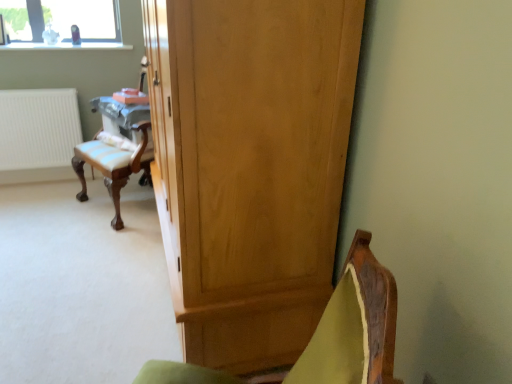
Question: Does light brown wood cupboard at center have a smaller size compared to white matte radiator at left?

Choices:
 (A) no
 (B) yes

Answer: (A)

Question: Is white matte radiator at left located within light brown wood cupboard at center?

Choices:
 (A) no
 (B) yes

Answer: (A)

Question: Can you confirm if light brown wood cupboard at center is positioned to the left of white matte radiator at left?

Choices:
 (A) yes
 (B) no

Answer: (B)

Question: Is light brown wood cupboard at center positioned in front of white matte radiator at left?

Choices:
 (A) yes
 (B) no

Answer: (A)

Question: Is light brown wood cupboard at center positioned beyond the bounds of white matte radiator at left?

Choices:
 (A) no
 (B) yes

Answer: (B)

Question: From a real-world perspective, is light brown wood cupboard at center below white matte radiator at left?

Choices:
 (A) yes
 (B) no

Answer: (B)

Question: Are white matte radiator at left and velvet green chair at lower right far apart?

Choices:
 (A) yes
 (B) no

Answer: (A)

Question: From a real-world perspective, does white matte radiator at left sit lower than velvet green chair at lower right?

Choices:
 (A) no
 (B) yes

Answer: (B)

Question: From a real-world perspective, is white matte radiator at left on velvet green chair at lower right?

Choices:
 (A) no
 (B) yes

Answer: (A)

Question: Is white matte radiator at left facing away from velvet green chair at lower right?

Choices:
 (A) no
 (B) yes

Answer: (A)

Question: Considering the relative positions of white matte radiator at left and velvet green chair at lower right in the image provided, is white matte radiator at left to the right of velvet green chair at lower right from the viewer's perspective?

Choices:
 (A) no
 (B) yes

Answer: (A)

Question: From the image's perspective, is white matte radiator at left above velvet green chair at lower right?

Choices:
 (A) no
 (B) yes

Answer: (B)

Question: Does light brown wood cupboard at center have a lesser width compared to velvet green chair at lower right?

Choices:
 (A) yes
 (B) no

Answer: (A)